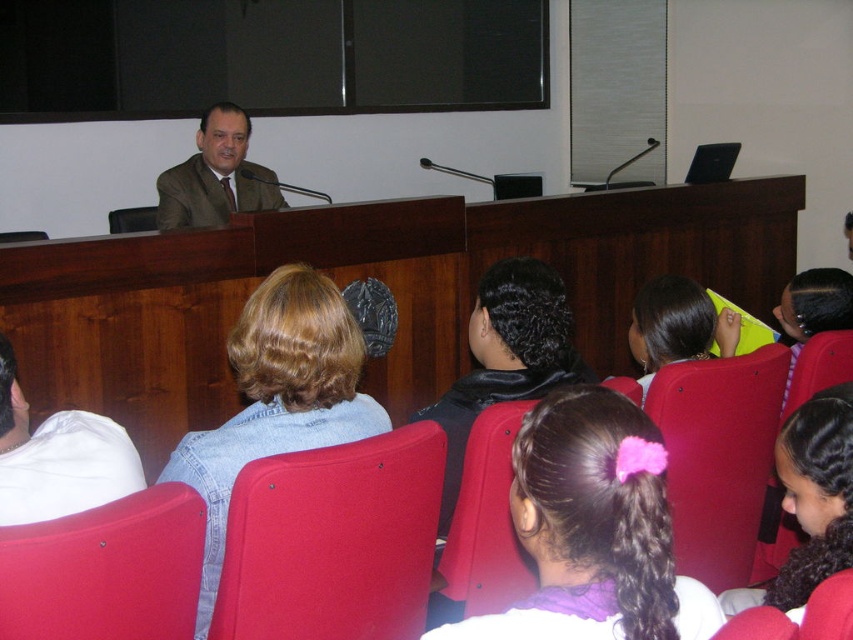
Question: Which is farther from the red plastic chair at lower center?

Choices:
 (A) purple fabric ponytail at center
 (B) matte red chair at center

Answer: (B)

Question: Observing the image, what is the correct spatial positioning of dark curly hair at lower right in reference to brown textured suit at upper center?

Choices:
 (A) right
 (B) left

Answer: (A)

Question: From the image, what is the correct spatial relationship of smooth red chair at center in relation to matte red chair at center?

Choices:
 (A) below
 (B) above

Answer: (A)

Question: Which of the following is the closest to the observer?

Choices:
 (A) matte red chair at center
 (B) red plastic chair at lower right
 (C) denim jacket at center

Answer: (C)

Question: Observing the image, what is the correct spatial positioning of smooth red chair at center in reference to matte red chair at center?

Choices:
 (A) below
 (B) above

Answer: (A)

Question: Which of the following is the farthest from the observer?

Choices:
 (A) purple fabric ponytail at center
 (B) white fabric shirt at lower left
 (C) red plastic chair at lower right

Answer: (C)